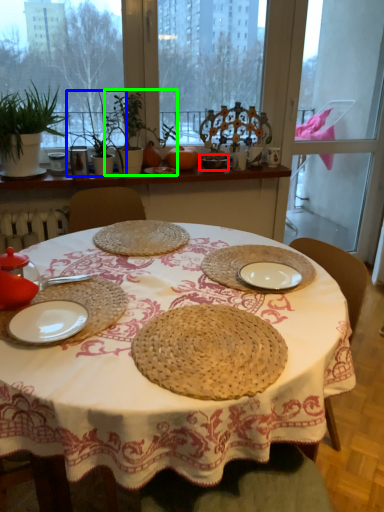
Question: Which is nearer to the tableware (highlighted by a red box)? plant (highlighted by a blue box) or plant (highlighted by a green box).

Choices:
 (A) plant
 (B) plant

Answer: (B)